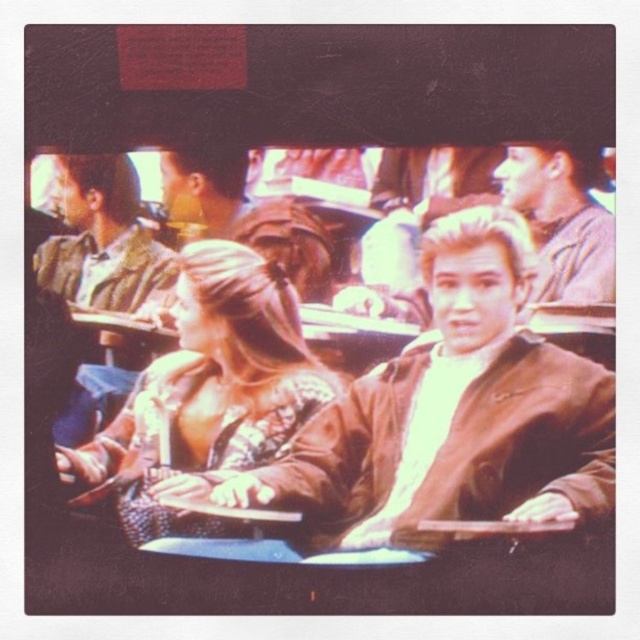
Question: Does brown leather jacket at center have a larger size compared to matte brown jacket at upper right?

Choices:
 (A) yes
 (B) no

Answer: (A)

Question: Does striped shirt at left come in front of matte brown jacket at upper right?

Choices:
 (A) no
 (B) yes

Answer: (A)

Question: Is brown leather jacket at center bigger than striped shirt at left?

Choices:
 (A) yes
 (B) no

Answer: (A)

Question: Which object is closer to the camera taking this photo?

Choices:
 (A) leather jacket at center
 (B) matte brown jacket at upper right
 (C) brown leather jacket at center

Answer: (B)

Question: Estimate the real-world distances between objects in this image. Which object is farther from the brown leather jacket at center?

Choices:
 (A) striped shirt at left
 (B) matte brown jacket at upper right

Answer: (A)

Question: Among these points, which one is nearest to the camera?

Choices:
 (A) (61, 196)
 (B) (426, 381)
 (C) (513, 200)
 (D) (211, 428)

Answer: (A)